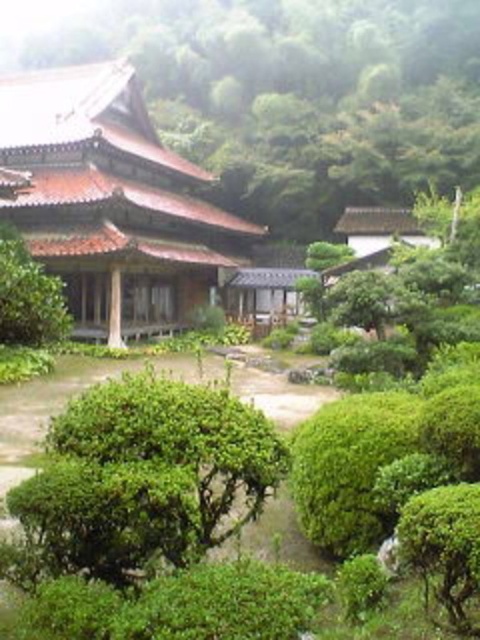
You are a visitor in the garden and want to take a photo of both the green leafy tree at upper center and the brown tile roof at center. Which object should you frame first in your camera to ensure both fit in the shot?

You should frame the green leafy tree at upper center first because its width is greater than the brown tile roof at center, so capturing its full width will naturally include the narrower brown tile roof at center in the shot.

You are a visitor in the garden and want to take a photo of both the green leafy tree at upper center and the brown tile roof at center. Which object should you focus on first if you want to capture both in the same frame without moving the camera?

The green leafy tree at upper center is bigger than the brown tile roof at center, so you should focus on the brown tile roof at center first to ensure both fit in the frame.

You are standing in the traditional East Asian garden and want to walk from the building to the stream. There are two points marked in the garden, point (299, 209) and point (68, 141). Which point is closer to you as you start walking towards the stream?

Point (68, 141) is closer to you because it is nearer to the camera compared to point (299, 209), which is further away.